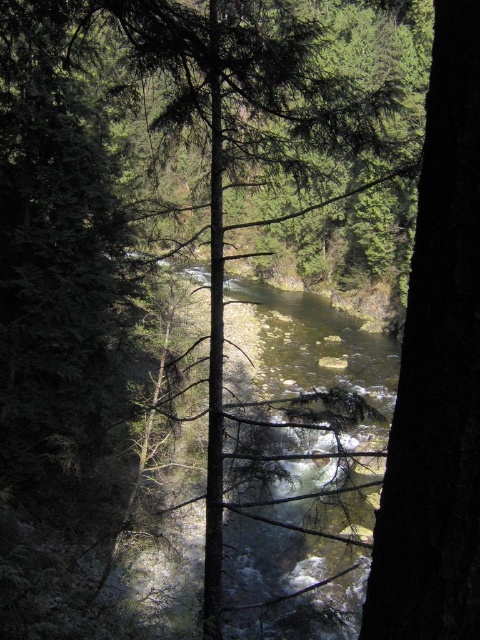
In the scene shown: Is translucent water at center wider than dark brown bark tree at right?

Correct, the width of translucent water at center exceeds that of dark brown bark tree at right.

Who is more distant from viewer, (267, 516) or (439, 621)?

The point (267, 516) is behind.

Which is in front, point (169, 506) or point (384, 570)?

Point (384, 570) is more forward.

Locate an element on the screen. The height and width of the screenshot is (640, 480). translucent water at center is located at coordinates (305, 356).